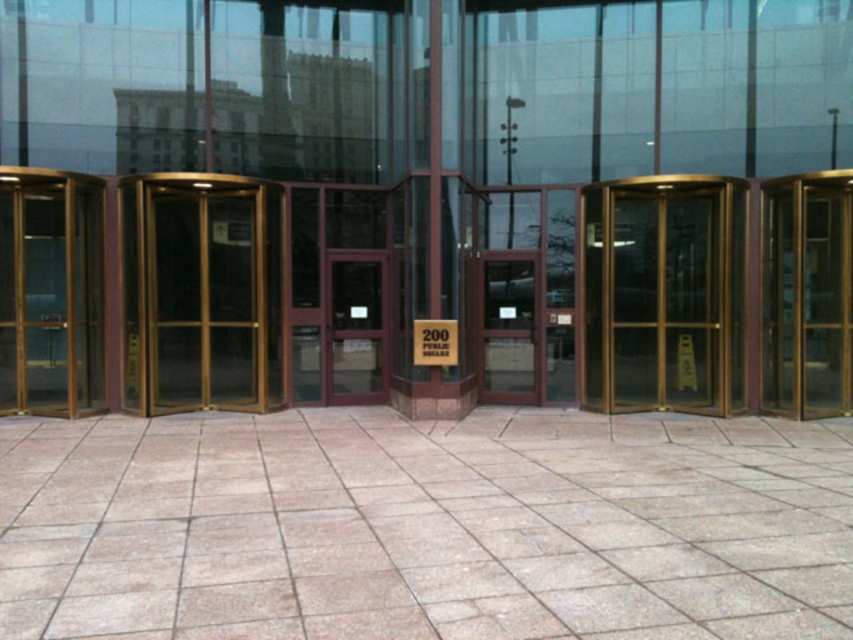
What do you see at coordinates (805, 294) in the screenshot? I see `gold metallic elevator at right` at bounding box center [805, 294].

Does gold metallic elevator at right lie behind matte glass door at center?

That is False.

Is point (801, 250) closer to viewer compared to point (374, 401)?

Yes.

Identify the location of gold metallic elevator at right. (805, 294).

Is matte glass door at center positioned before white paper sign at center?

No, it is behind white paper sign at center.

Who is taller, matte glass door at center or white paper sign at center?

With more height is matte glass door at center.

Where is `matte glass door at center`? Image resolution: width=853 pixels, height=640 pixels. matte glass door at center is located at coordinates (355, 328).

The height and width of the screenshot is (640, 853). In order to click on matte glass door at center in this screenshot , I will do `click(355, 328)`.

Consider the image. Does gold metallic elevator at left appear on the right side of white paper sign at center?

Incorrect, gold metallic elevator at left is not on the right side of white paper sign at center.

I want to click on gold metallic elevator at left, so click(51, 292).

Find the location of `gold metallic elevator at left`. gold metallic elevator at left is located at coordinates (51, 292).